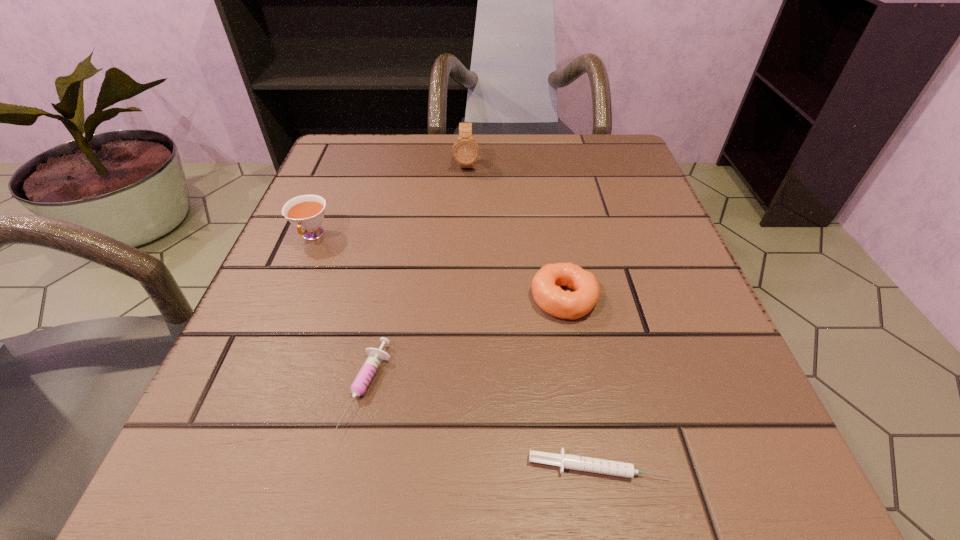
Locate an element on the screen. vacant region between the third shortest object and the farthest object is located at coordinates (516, 232).

In order to click on vacant area between the third nearest object and the watch in this screenshot , I will do `click(516, 232)`.

Locate an element on the screen. This screenshot has height=540, width=960. free spot between the nearest object and the taller syringe is located at coordinates (483, 427).

The image size is (960, 540). I want to click on empty space between the doughnut and the fourth shortest object, so click(438, 267).

Locate an element on the screen. empty space that is in between the taller syringe and the third shortest object is located at coordinates (466, 343).

The height and width of the screenshot is (540, 960). I want to click on free space between the third nearest object and the tallest object, so click(516, 232).

Where is `empty location between the third shortest object and the nearer syringe`? The height and width of the screenshot is (540, 960). empty location between the third shortest object and the nearer syringe is located at coordinates (581, 382).

I want to click on object that is the nearest to the second nearest object, so click(601, 466).

Select which object is the second closest to the third tallest object. Please provide its 2D coordinates. Your answer should be formatted as a tuple, i.e. [(x, y)], where the tuple contains the x and y coordinates of a point satisfying the conditions above.

[(364, 377)]

Find the location of `free space that satisfies the following two spatial constraints: 1. on the side of the second tallest object with the handle; 2. on the right side of the shortest object`. free space that satisfies the following two spatial constraints: 1. on the side of the second tallest object with the handle; 2. on the right side of the shortest object is located at coordinates (216, 466).